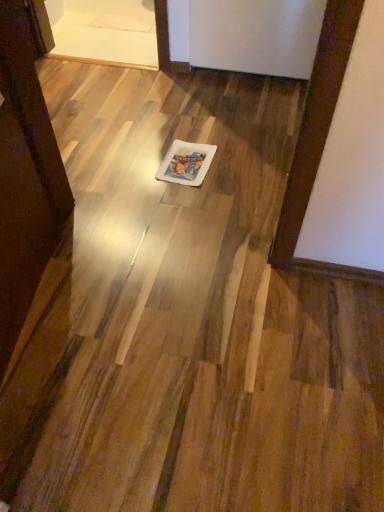
Identify the location of white glossy square plate at center. (186, 163).

Measure the distance between white glossy square plate at center and camera.

white glossy square plate at center is 5.86 feet away from camera.

In order to face white glossy square plate at center, should I rotate leftwards or rightwards?

Turn left by 0.765 degrees to look at white glossy square plate at center.

This screenshot has height=512, width=384. What do you see at coordinates (186, 163) in the screenshot?
I see `white glossy square plate at center` at bounding box center [186, 163].

You are a GUI agent. You are given a task and a screenshot of the screen. Output one action in this format:
    pyautogui.click(x=<x>, y=<y>)
    Task: Click on the white glossy square plate at center
    The height and width of the screenshot is (512, 384).
    Given the screenshot: What is the action you would take?
    pyautogui.click(x=186, y=163)